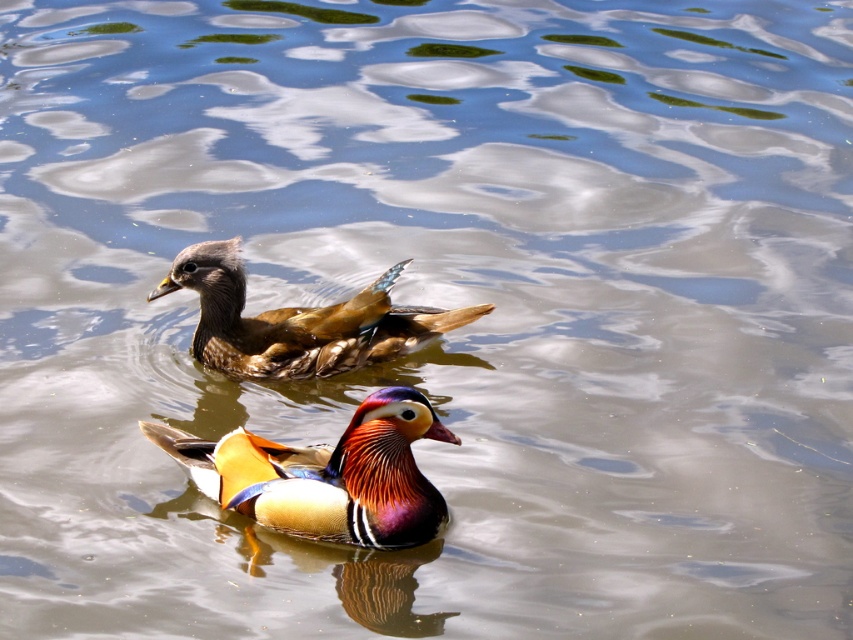
How distant is shiny multicolored duck at center from brown matte duck at upper center?

shiny multicolored duck at center and brown matte duck at upper center are 32.89 inches apart.

Does shiny multicolored duck at center appear on the left side of brown matte duck at upper center?

Incorrect, shiny multicolored duck at center is not on the left side of brown matte duck at upper center.

You are a GUI agent. You are given a task and a screenshot of the screen. Output one action in this format:
    pyautogui.click(x=<x>, y=<y>)
    Task: Click on the shiny multicolored duck at center
    This screenshot has height=640, width=853.
    Given the screenshot: What is the action you would take?
    coord(328,474)

This screenshot has width=853, height=640. I want to click on shiny multicolored duck at center, so click(x=328, y=474).